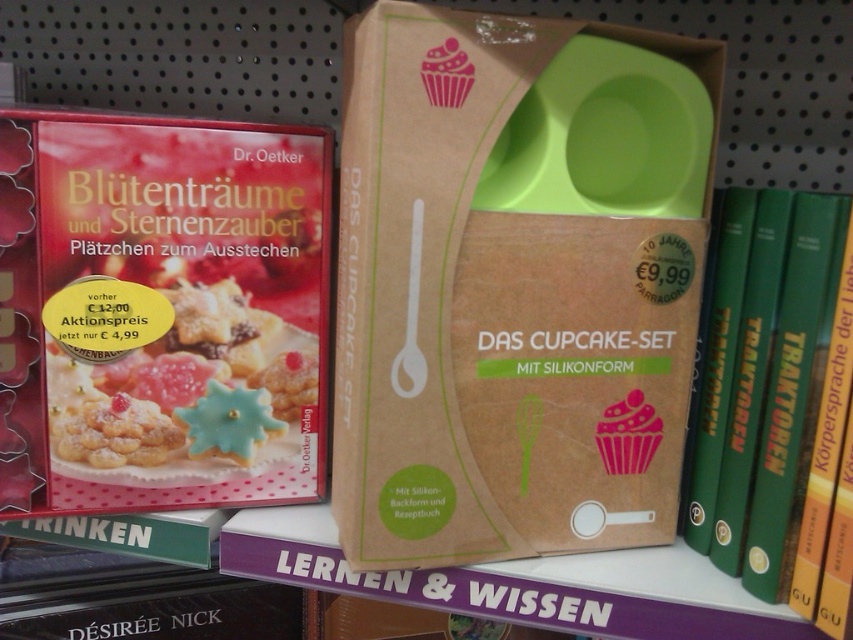
Question: Which point appears closest to the camera in this image?

Choices:
 (A) (804, 292)
 (B) (175, 449)

Answer: (A)

Question: Is matte brown cardboard box at center below matte red book at left?

Choices:
 (A) yes
 (B) no

Answer: (B)

Question: Does matte brown cardboard box at center come behind matte red book at left?

Choices:
 (A) yes
 (B) no

Answer: (B)

Question: Which point appears closest to the camera in this image?

Choices:
 (A) (782, 593)
 (B) (76, 308)
 (C) (88, 381)

Answer: (A)

Question: Which point is closer to the camera?

Choices:
 (A) (10, 483)
 (B) (599, 337)
 (C) (776, 460)

Answer: (C)

Question: Can you confirm if matte red book at left is positioned above green matte book at right?

Choices:
 (A) no
 (B) yes

Answer: (B)